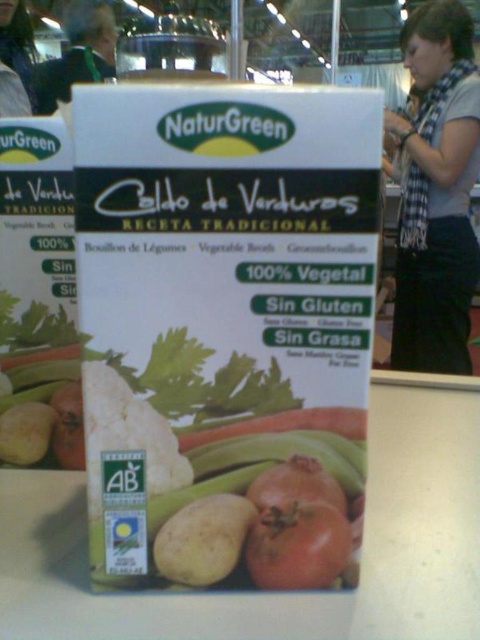
Is point (317, 524) positioned behind point (96, 33)?

That is False.

Is shiny red tomato at center to the right of green fabric at upper left from the viewer's perspective?

Indeed, shiny red tomato at center is positioned on the right side of green fabric at upper left.

What are the coordinates of `shiny red tomato at center` in the screenshot? It's located at (298, 545).

Identify the location of matte white potato at center. (203, 540).

Which of these two, matte white potato at center or green fabric at upper left, stands shorter?

matte white potato at center

Locate an element on the screen. matte white potato at center is located at coordinates (203, 540).

Does blue plaid scarf at upper right have a greater height compared to green fabric at upper left?

Yes.

I want to click on blue plaid scarf at upper right, so click(x=436, y=193).